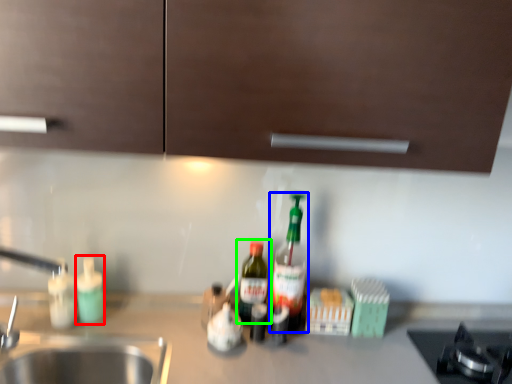
Question: Which is farther away from bottle (highlighted by a red box)? bottle (highlighted by a blue box) or bottle (highlighted by a green box)?

Choices:
 (A) bottle
 (B) bottle

Answer: (A)